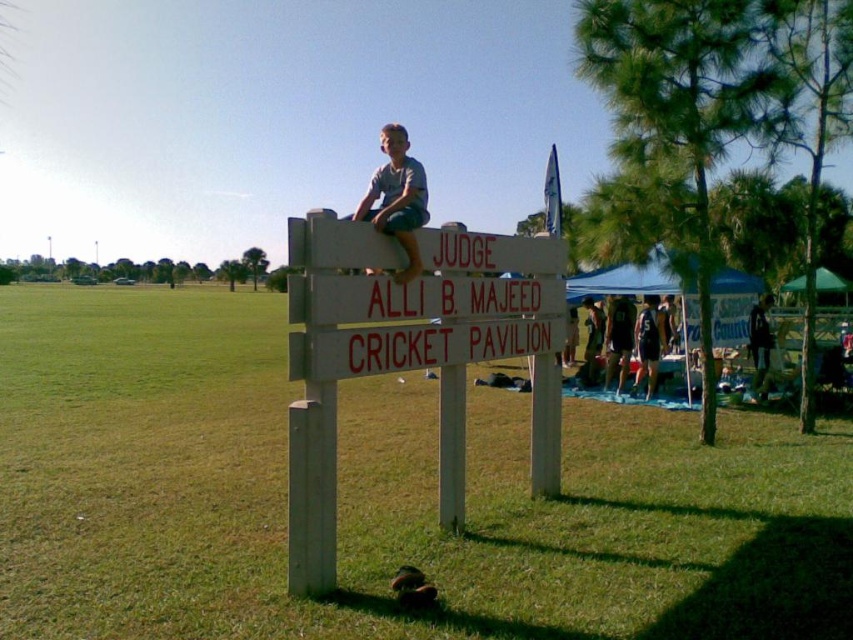
Does white wooden sign at center appear over gray cotton shirt at upper center?

No.

Is white wooden sign at center smaller than gray cotton shirt at upper center?

Yes.

This screenshot has height=640, width=853. Identify the location of white wooden sign at center. (379, 497).

Does white wooden sign at center appear on the left side of dark blue shirt at center?

Yes, white wooden sign at center is to the left of dark blue shirt at center.

Does white wooden sign at center lie in front of dark blue shirt at center?

Yes, it is.

Does point (123, 492) come in front of point (770, 298)?

Yes, point (123, 492) is closer to viewer.

This screenshot has width=853, height=640. I want to click on white wooden sign at center, so tap(379, 497).

Can you confirm if white wooden sign at center is taller than white wood sign at center?

Incorrect, white wooden sign at center's height is not larger of white wood sign at center's.

Can you confirm if white wooden sign at center is smaller than white wood sign at center?

No.

Measure the distance between point (770, 545) and camera.

Point (770, 545) is 5.68 meters from camera.

Where is `white wooden sign at center`? The image size is (853, 640). white wooden sign at center is located at coordinates (379, 497).